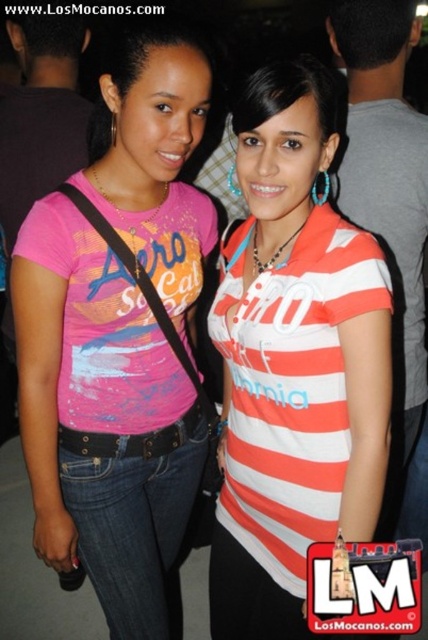
Who is taller, pink matte t-shirt at center or striped cotton shirt at center?

pink matte t-shirt at center is taller.

Is point (119, 54) positioned behind point (273, 412)?

No, (119, 54) is in front of (273, 412).

In order to click on pink matte t-shirt at center in this screenshot , I will do `click(119, 340)`.

Locate an element on the screen. The height and width of the screenshot is (640, 428). pink matte t-shirt at center is located at coordinates [x=119, y=340].